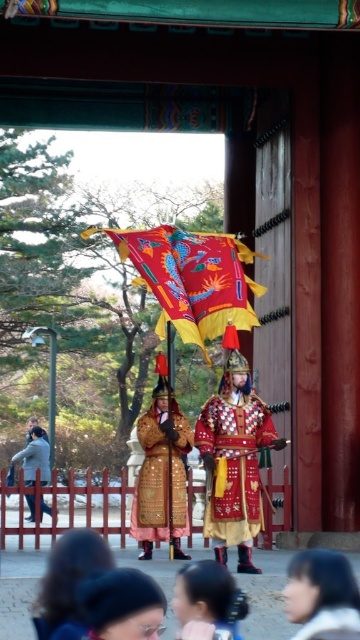
You are a photographer at the ceremony and want to capture both the smooth beige hair at lower center and the gold metallic armor at lower left in the same frame. Which object should you focus on first to ensure both are in focus?

The smooth beige hair at lower center has a lesser height compared to gold metallic armor at lower left. To ensure both are in focus, you should focus on the gold metallic armor at lower left first since it is taller and will help capture the depth of field needed for the shorter smooth beige hair at lower center.

You are an event planner setting up a photo shoot at this historical site. You need to position two models wearing the embroidered silk robe at center and the gold textured robe at center. Since space is limited, which robe requires more horizontal space to accommodate its width?

The embroidered silk robe at center requires more horizontal space because its width is larger than the gold textured robe at center.

In the scene described, there is an object labeled as smooth brown hair at lower left located at point (69, 582). Could you identify the exact coordinates of this object?

The smooth brown hair at lower left is located at point (69, 582).